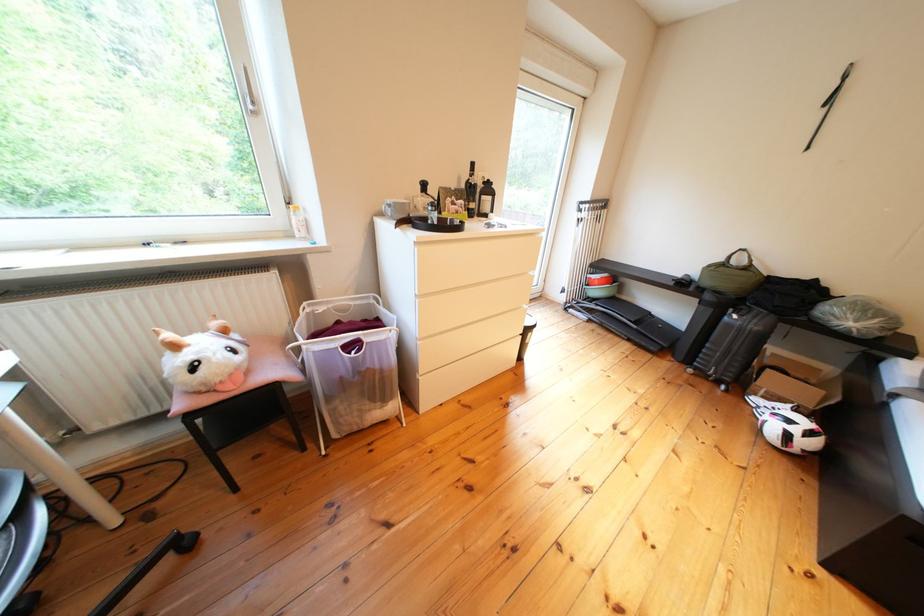
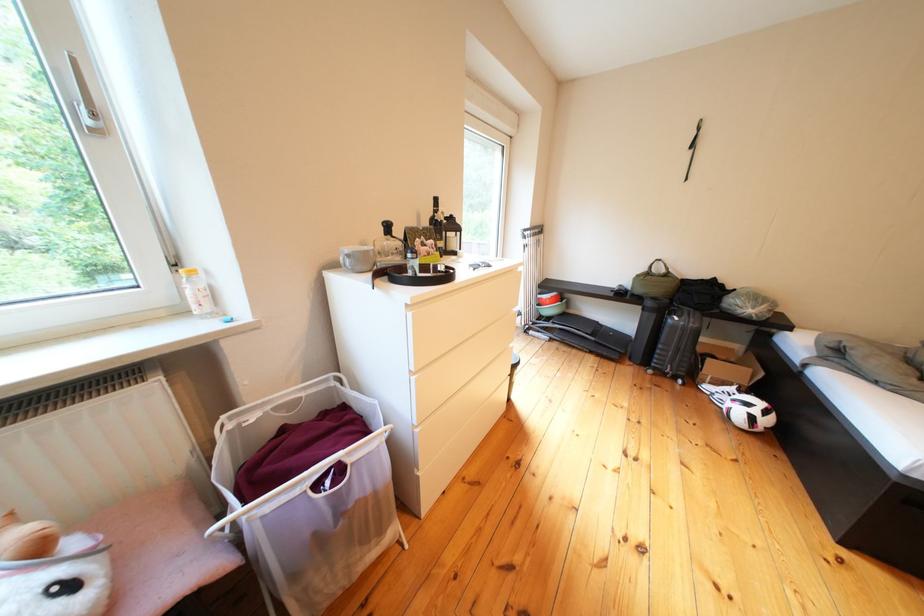
Which direction would the cameraman need to move to produce the second image?

The cameraman moved toward left, forward.